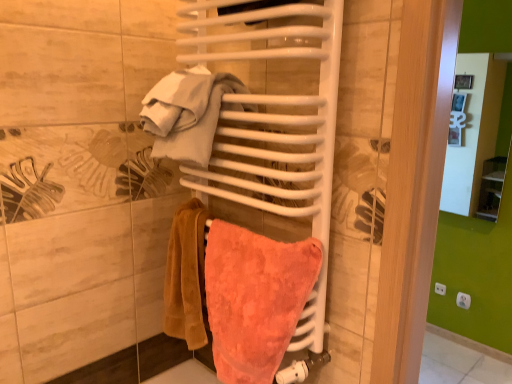
Question: Looking at their shapes, would you say coral terry towel at center is wider or thinner than white cotton towel at upper center?

Choices:
 (A) wide
 (B) thin

Answer: (B)

Question: Visually, is coral terry towel at center positioned to the left or to the right of white cotton towel at upper center?

Choices:
 (A) right
 (B) left

Answer: (A)

Question: In terms of height, does coral terry towel at center look taller or shorter compared to white cotton towel at upper center?

Choices:
 (A) tall
 (B) short

Answer: (A)

Question: Is white cotton towel at upper center inside the boundaries of coral terry towel at center, or outside?

Choices:
 (A) inside
 (B) outside

Answer: (B)

Question: Considering the relative positions of white cotton towel at upper center and coral terry towel at center in the image provided, is white cotton towel at upper center to the left or to the right of coral terry towel at center?

Choices:
 (A) right
 (B) left

Answer: (B)

Question: Looking at the image, does white cotton towel at upper center seem bigger or smaller compared to coral terry towel at center?

Choices:
 (A) small
 (B) big

Answer: (A)

Question: In the image, is white cotton towel at upper center positioned in front of or behind coral terry towel at center?

Choices:
 (A) front
 (B) behind

Answer: (B)